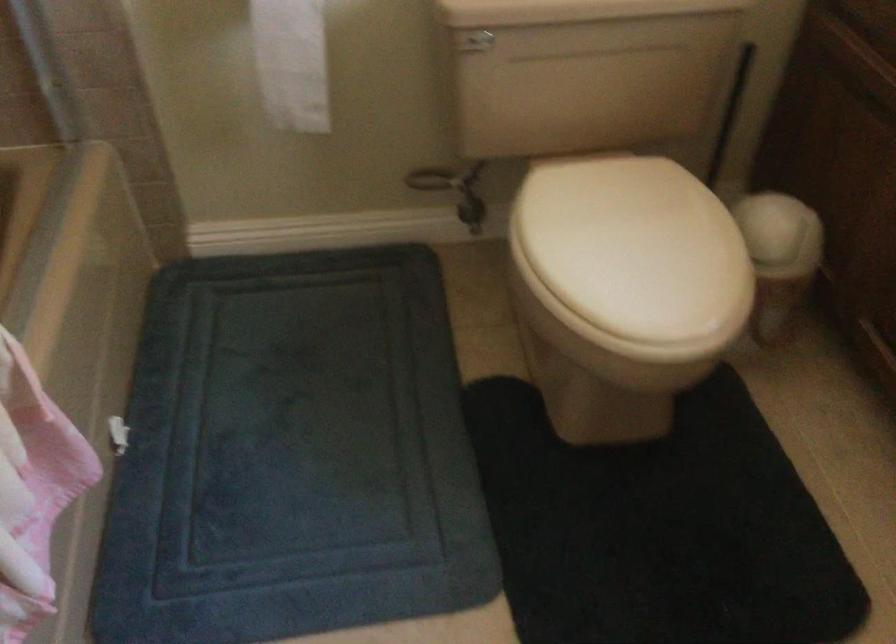
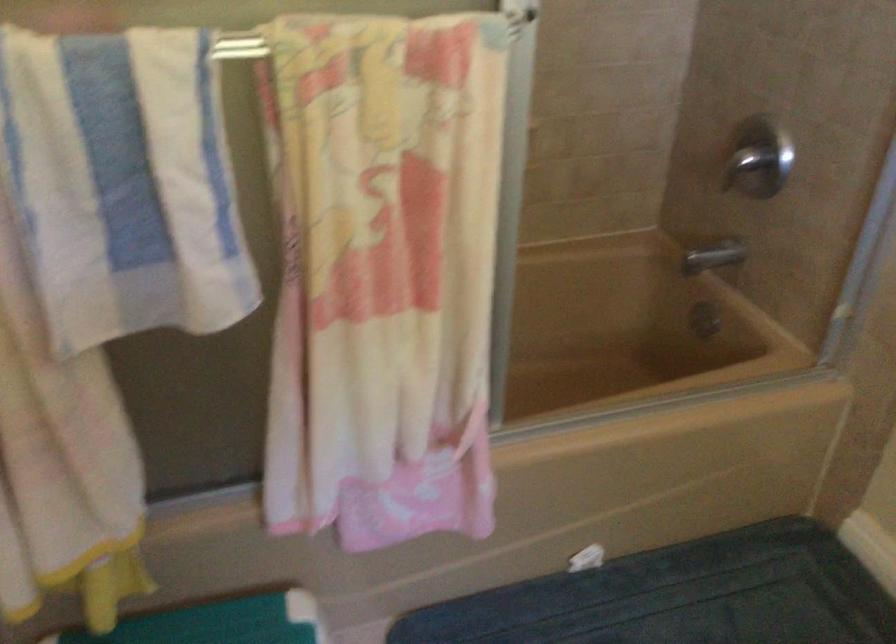
Based on the continuous images, in which direction is the camera rotating?

The rotation direction of the camera is left-down.